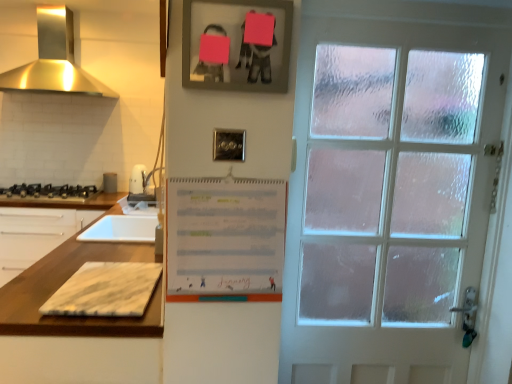
Question: From the image's perspective, is marble cutting board at lower left located above metallic silver toaster at left?

Choices:
 (A) yes
 (B) no

Answer: (B)

Question: Can you confirm if marble cutting board at lower left is thinner than metallic silver toaster at left?

Choices:
 (A) yes
 (B) no

Answer: (B)

Question: Is marble cutting board at lower left at the right side of metallic silver toaster at left?

Choices:
 (A) no
 (B) yes

Answer: (B)

Question: Is marble cutting board at lower left not inside metallic silver toaster at left?

Choices:
 (A) no
 (B) yes

Answer: (B)

Question: Is there a large distance between marble cutting board at lower left and metallic silver toaster at left?

Choices:
 (A) yes
 (B) no

Answer: (A)

Question: Does marble cutting board at lower left have a greater width compared to metallic silver toaster at left?

Choices:
 (A) yes
 (B) no

Answer: (A)

Question: Is white marble cutting board at left completely or partially outside of black matte gas stove at left?

Choices:
 (A) no
 (B) yes

Answer: (B)

Question: Does white marble cutting board at left lie in front of black matte gas stove at left?

Choices:
 (A) no
 (B) yes

Answer: (B)

Question: Can you confirm if white marble cutting board at left is smaller than black matte gas stove at left?

Choices:
 (A) no
 (B) yes

Answer: (A)

Question: Does white marble cutting board at left touch black matte gas stove at left?

Choices:
 (A) yes
 (B) no

Answer: (B)

Question: From a real-world perspective, is white marble cutting board at left physically above black matte gas stove at left?

Choices:
 (A) yes
 (B) no

Answer: (B)

Question: Does white marble cutting board at left contain black matte gas stove at left?

Choices:
 (A) no
 (B) yes

Answer: (A)

Question: Is metallic silver toaster at left to the left of marble cutting board at lower left from the viewer's perspective?

Choices:
 (A) no
 (B) yes

Answer: (B)